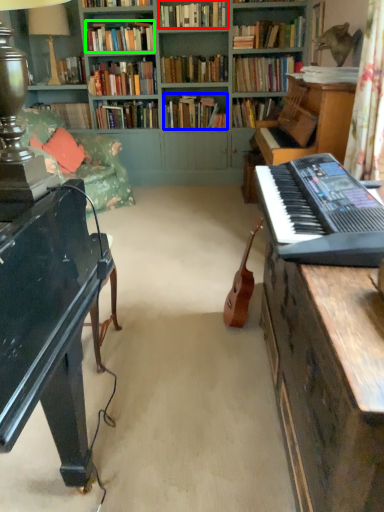
Question: Considering the real-world distances, which object is farthest from book (highlighted by a red box)? book (highlighted by a blue box) or book (highlighted by a green box)?

Choices:
 (A) book
 (B) book

Answer: (A)